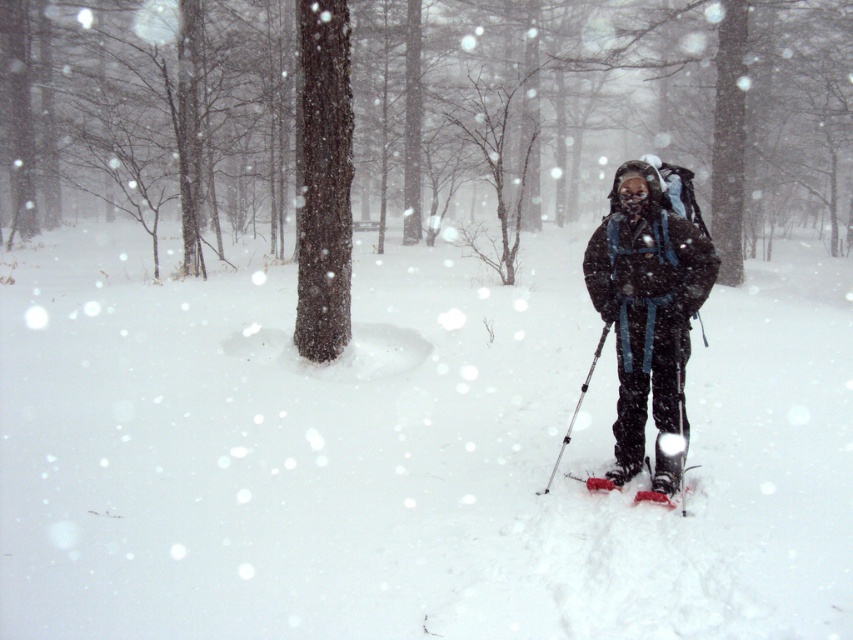
You are planning to take a photo of the white fluffy snow at center and the matte black jacket at center. Which object will appear larger in the photo?

The white fluffy snow at center will appear larger in the photo because it is bigger than the matte black jacket at center.

You are a snowshoeing enthusiast planning to take a photo of the white fluffy snow at center. To ensure the snow is in focus, where should you aim your camera lens?

You should aim your camera lens at the coordinates point (407, 452) where the white fluffy snow at center is located.

You are planning to take a photo of the white fluffy snow at center and the white rubber snowshoe at center. Which object should you focus on first if you want both to be in sharp focus?

The white rubber snowshoe at center is closer to the camera than the white fluffy snow at center, so you should focus on the white rubber snowshoe at center first to ensure both are in sharp focus.